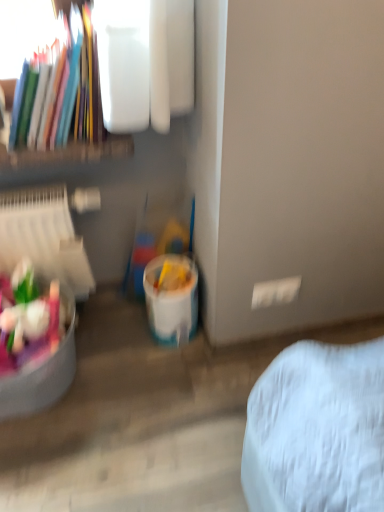
Question: Is matte plastic toys at lower left positioned with its back to matte plastic books at upper left?

Choices:
 (A) no
 (B) yes

Answer: (A)

Question: From a real-world perspective, is matte plastic toys at lower left located higher than matte plastic books at upper left?

Choices:
 (A) yes
 (B) no

Answer: (B)

Question: Is matte plastic books at upper left completely or partially inside matte plastic toys at lower left?

Choices:
 (A) no
 (B) yes

Answer: (A)

Question: Is matte plastic toys at lower left taller than matte plastic books at upper left?

Choices:
 (A) yes
 (B) no

Answer: (B)

Question: From a real-world perspective, is matte plastic toys at lower left located beneath matte plastic books at upper left?

Choices:
 (A) yes
 (B) no

Answer: (A)

Question: Considering the relative positions of white plastic bucket at lower center and matte plastic toys at lower left in the image provided, is white plastic bucket at lower center to the left or to the right of matte plastic toys at lower left?

Choices:
 (A) right
 (B) left

Answer: (A)

Question: From a real-world perspective, relative to matte plastic toys at lower left, is white plastic bucket at lower center vertically above or below?

Choices:
 (A) above
 (B) below

Answer: (B)

Question: Based on their sizes in the image, would you say white plastic bucket at lower center is bigger or smaller than matte plastic toys at lower left?

Choices:
 (A) small
 (B) big

Answer: (A)

Question: Does point (150, 267) appear closer or farther from the camera than point (13, 290)?

Choices:
 (A) closer
 (B) farther

Answer: (B)

Question: Is point (26, 304) closer or farther from the camera than point (92, 53)?

Choices:
 (A) closer
 (B) farther

Answer: (B)

Question: Would you say matte plastic toys at lower left is to the left or to the right of matte plastic books at upper left in the picture?

Choices:
 (A) left
 (B) right

Answer: (A)

Question: From the image's perspective, is matte plastic toys at lower left located above or below matte plastic books at upper left?

Choices:
 (A) above
 (B) below

Answer: (B)

Question: In the image, is matte plastic toys at lower left positioned in front of or behind matte plastic books at upper left?

Choices:
 (A) front
 (B) behind

Answer: (B)

Question: In the image, is matte plastic toys at lower left positioned in front of or behind white plastic bucket at lower center?

Choices:
 (A) behind
 (B) front

Answer: (B)

Question: From a real-world perspective, relative to white plastic bucket at lower center, is matte plastic toys at lower left vertically above or below?

Choices:
 (A) below
 (B) above

Answer: (B)